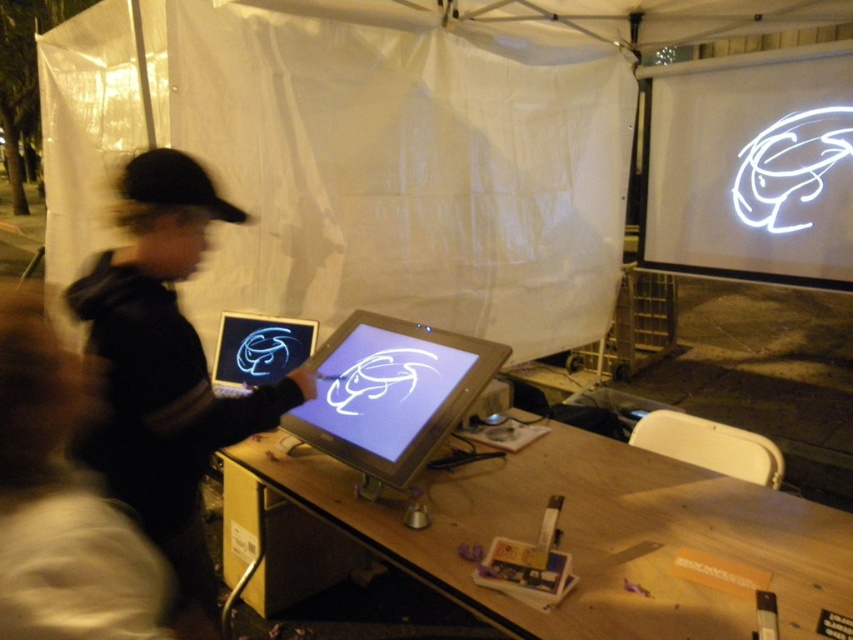
You are setting up an interactive art installation and need to position a new light source. The light must be placed below the white glossy projection screen at upper right but above the matte plastic screen at center. Is this possible given their current positions?

The white glossy projection screen at upper right is above the matte plastic screen at center, so placing the light below the white glossy projection screen at upper right and above the matte plastic screen at center is possible between them.

You are setting up an art exhibition and need to decide which screen to use for a large digital display. Given the white glossy projection screen at upper right and the matte plastic screen at center, which one would be more suitable for projecting bright, vivid images in a well lit room?

The white glossy projection screen at upper right is bigger and more suitable for projecting bright, vivid images in a well lit room because it reflects more light, making the images appear brighter and clearer compared to the matte plastic screen at center.